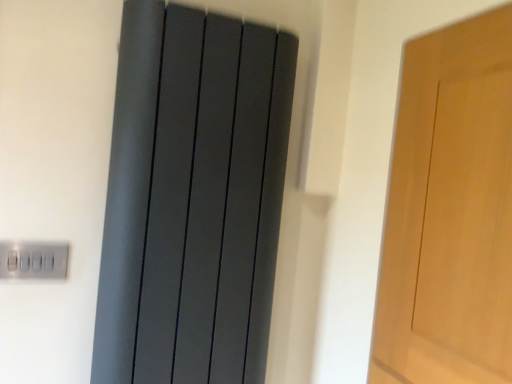
This screenshot has height=384, width=512. What do you see at coordinates (193, 197) in the screenshot? I see `matte gray radiator at center` at bounding box center [193, 197].

Locate an element on the screen. The image size is (512, 384). matte gray radiator at center is located at coordinates (193, 197).

What do you see at coordinates (33, 260) in the screenshot?
I see `satin silver switch at lower left` at bounding box center [33, 260].

At what (x,y) coordinates should I click in order to perform the action: click on satin silver switch at lower left. Please return your answer as a coordinate pair (x, y). Image resolution: width=512 pixels, height=384 pixels. Looking at the image, I should click on (33, 260).

Where is `matte gray radiator at center`? Image resolution: width=512 pixels, height=384 pixels. matte gray radiator at center is located at coordinates (193, 197).

Consider the image. Between satin silver switch at lower left and matte gray radiator at center, which one appears on the right side from the viewer's perspective?

Positioned to the right is matte gray radiator at center.

In the scene shown: Between satin silver switch at lower left and matte gray radiator at center, which one is positioned in front?

matte gray radiator at center is more forward.

Is point (42, 262) positioned in front of point (263, 139)?

Yes, point (42, 262) is in front of point (263, 139).

From the image's perspective, between satin silver switch at lower left and matte gray radiator at center, who is located below?

From the image's view, satin silver switch at lower left is below.

From a real-world perspective, which is physically above, satin silver switch at lower left or matte gray radiator at center?

matte gray radiator at center is physically above.

Considering the sizes of objects satin silver switch at lower left and matte gray radiator at center in the image provided, who is wider, satin silver switch at lower left or matte gray radiator at center?

With larger width is matte gray radiator at center.

From the picture: Which of these two, satin silver switch at lower left or matte gray radiator at center, stands shorter?

satin silver switch at lower left.

Which of these two, satin silver switch at lower left or matte gray radiator at center, is bigger?

matte gray radiator at center is bigger.

Is matte gray radiator at center completely or partially inside satin silver switch at lower left?

Definitely not — matte gray radiator at center is not inside satin silver switch at lower left.

Is satin silver switch at lower left touching matte gray radiator at center?

There is a gap between satin silver switch at lower left and matte gray radiator at center.

In the scene shown: Is satin silver switch at lower left positioned with its back to matte gray radiator at center?

No, satin silver switch at lower left is not facing away from matte gray radiator at center.

How many degrees apart are the facing directions of satin silver switch at lower left and matte gray radiator at center?

satin silver switch at lower left and matte gray radiator at center are facing 2.22 degrees away from each other.

How far apart are satin silver switch at lower left and matte gray radiator at center?

satin silver switch at lower left is 14.06 inches from matte gray radiator at center.

In the image, there is a matte gray radiator at center. Where is `electric outlet below it (from a real-world perspective)`? The width and height of the screenshot is (512, 384). electric outlet below it (from a real-world perspective) is located at coordinates (33, 260).

Is matte gray radiator at center at the left side of satin silver switch at lower left?

Incorrect, matte gray radiator at center is not on the left side of satin silver switch at lower left.

Which object is more forward, matte gray radiator at center or satin silver switch at lower left?

matte gray radiator at center.

Which is closer to the camera, (138, 337) or (38, 264)?

Positioned in front is point (138, 337).

From the image's perspective, which is below, matte gray radiator at center or satin silver switch at lower left?

satin silver switch at lower left is shown below in the image.

From a real-world perspective, between matte gray radiator at center and satin silver switch at lower left, who is vertically lower?

satin silver switch at lower left, from a real-world perspective.

Which object is thinner, matte gray radiator at center or satin silver switch at lower left?

satin silver switch at lower left.

Considering the relative sizes of matte gray radiator at center and satin silver switch at lower left in the image provided, is matte gray radiator at center shorter than satin silver switch at lower left?

No.

Does matte gray radiator at center have a larger size compared to satin silver switch at lower left?

Indeed, matte gray radiator at center has a larger size compared to satin silver switch at lower left.

Is matte gray radiator at center inside the boundaries of satin silver switch at lower left, or outside?

matte gray radiator at center is not inside satin silver switch at lower left, it's outside.

Are matte gray radiator at center and satin silver switch at lower left beside each other?

No, matte gray radiator at center is not next to satin silver switch at lower left.

Is matte gray radiator at center facing away from satin silver switch at lower left?

No.

In the scene shown: Can you tell me how much matte gray radiator at center and satin silver switch at lower left differ in facing direction?

They differ by 2.22 degrees in their facing directions.

From the picture: Measure the distance between matte gray radiator at center and satin silver switch at lower left.

matte gray radiator at center is 35.72 centimeters from satin silver switch at lower left.

This screenshot has height=384, width=512. Identify the location of curtain positioned vertically above the satin silver switch at lower left (from a real-world perspective). (193, 197).

Locate an element on the screen. The width and height of the screenshot is (512, 384). electric outlet below the matte gray radiator at center (from the image's perspective) is located at coordinates (33, 260).

In the image, there is a satin silver switch at lower left. Where is `curtain above it (from the image's perspective)`? curtain above it (from the image's perspective) is located at coordinates (193, 197).